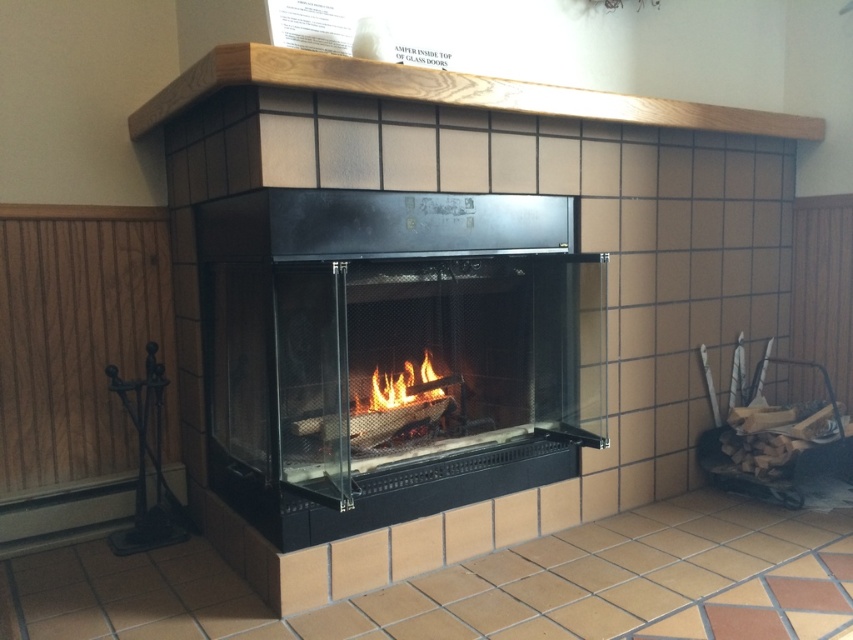
Who is shorter, black glass fireplace at center or wooden mantle at upper center?

wooden mantle at upper center is shorter.

The width and height of the screenshot is (853, 640). I want to click on black glass fireplace at center, so click(393, 353).

This screenshot has height=640, width=853. What are the coordinates of `black glass fireplace at center` in the screenshot? It's located at (393, 353).

Is the position of black glass fireplace at center more distant than that of flamewoodfire at center?

No, it is in front of flamewoodfire at center.

Which is in front, point (335, 237) or point (366, 410)?

Point (335, 237) is in front.

In order to click on black glass fireplace at center in this screenshot , I will do pos(393,353).

From the picture: Who is positioned more to the right, wooden mantle at upper center or flamewoodfire at center?

wooden mantle at upper center

Who is shorter, wooden mantle at upper center or flamewoodfire at center?

flamewoodfire at center is shorter.

Is point (392, 92) positioned after point (440, 381)?

No, (392, 92) is in front of (440, 381).

At what (x,y) coordinates should I click in order to perform the action: click on wooden mantle at upper center. Please return your answer as a coordinate pair (x, y). This screenshot has width=853, height=640. Looking at the image, I should click on click(445, 92).